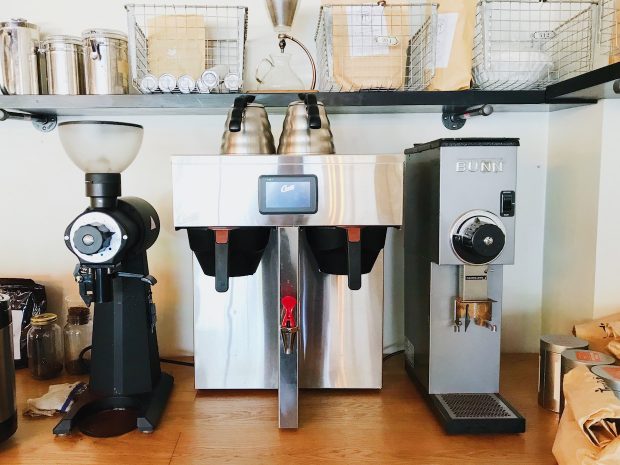
Locate an element on the screen. This screenshot has width=620, height=465. wooden counter is located at coordinates (232, 436).